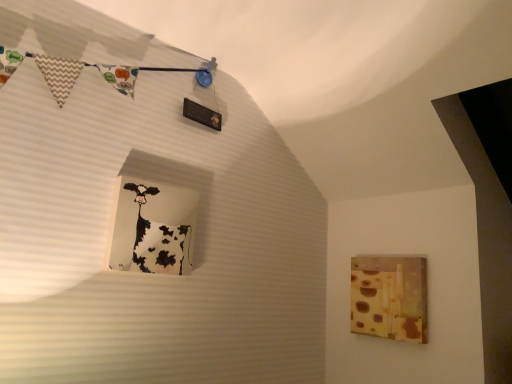
Question: Based on their positions, is white glossy cow at upper left located to the left or right of matte yellow cheese at right?

Choices:
 (A) left
 (B) right

Answer: (A)

Question: Is white glossy cow at upper left inside the boundaries of matte yellow cheese at right, or outside?

Choices:
 (A) outside
 (B) inside

Answer: (A)

Question: Is white glossy cow at upper left taller or shorter than matte yellow cheese at right?

Choices:
 (A) tall
 (B) short

Answer: (B)

Question: From the image's perspective, is matte yellow cheese at right located above or below white glossy cow at upper left?

Choices:
 (A) above
 (B) below

Answer: (B)

Question: Would you say matte yellow cheese at right is inside or outside white glossy cow at upper left?

Choices:
 (A) inside
 (B) outside

Answer: (B)

Question: Is matte yellow cheese at right bigger or smaller than white glossy cow at upper left?

Choices:
 (A) big
 (B) small

Answer: (A)

Question: Based on their positions, is matte yellow cheese at right located to the left or right of white glossy cow at upper left?

Choices:
 (A) right
 (B) left

Answer: (A)